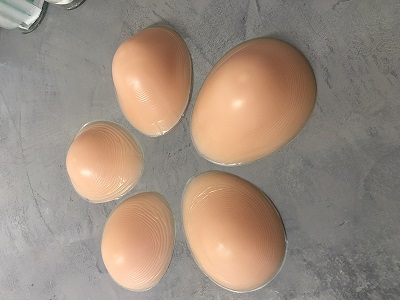
The height and width of the screenshot is (300, 400). I want to click on glass, so click(x=23, y=11).